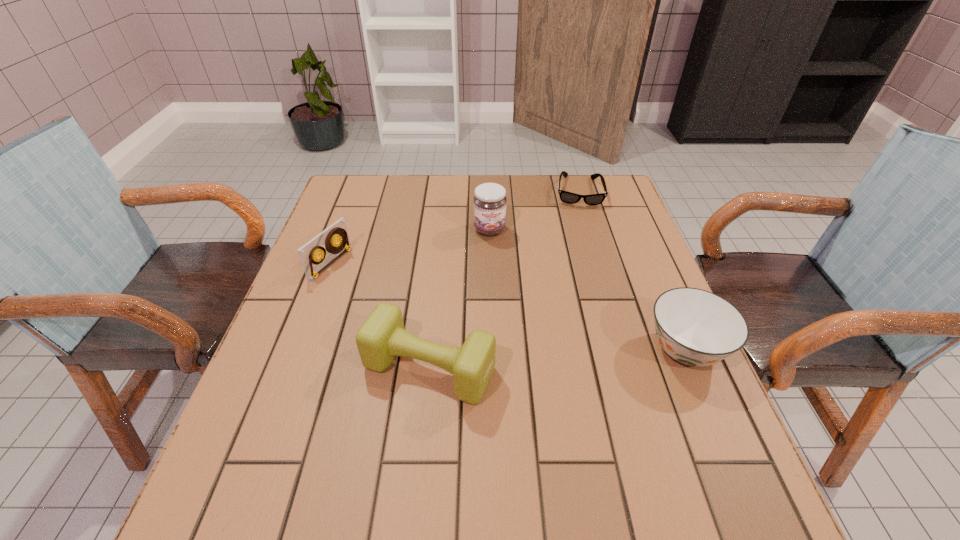
At what (x,y) coordinates should I click in order to perform the action: click on free space on the desktop that is between the dumbbell and the soup bowl and is positioned at the front of the leftmost object with visible reels. Please return your answer as a coordinate pair (x, y). Looking at the image, I should click on (554, 359).

You are a GUI agent. You are given a task and a screenshot of the screen. Output one action in this format:
    pyautogui.click(x=<x>, y=<y>)
    Task: Click on the vacant spot on the desktop that is between the dumbbell and the soup bowl and is positioned on the front label of the jam
    
    Given the screenshot: What is the action you would take?
    pyautogui.click(x=530, y=361)

The image size is (960, 540). I want to click on free space on the desktop that is between the dumbbell and the soup bowl and is positioned on the front-facing side of the farthest object, so click(x=587, y=356).